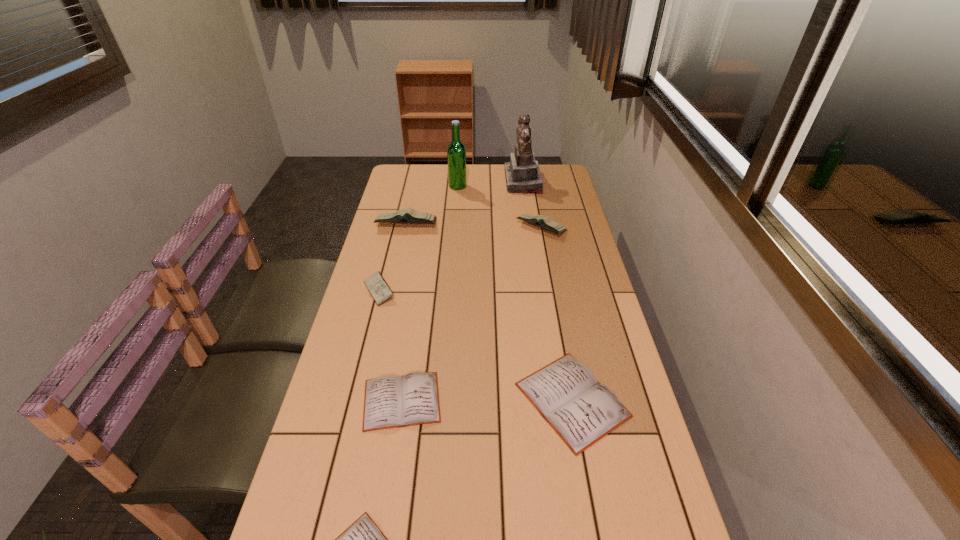
Find the location of `the seventh tallest object`. the seventh tallest object is located at coordinates (390, 401).

Find the location of a particular element. The height and width of the screenshot is (540, 960). the fifth tallest diary is located at coordinates (390, 401).

Where is `blank space located 0.390m on the front-facing side of the figurine`? This screenshot has height=540, width=960. blank space located 0.390m on the front-facing side of the figurine is located at coordinates (414, 182).

Where is `vacant region located on the front-facing side of the figurine`? This screenshot has height=540, width=960. vacant region located on the front-facing side of the figurine is located at coordinates (477, 182).

Find the location of a particular element. free region located on the front-facing side of the figurine is located at coordinates (427, 182).

You are a GUI agent. You are given a task and a screenshot of the screen. Output one action in this format:
    pyautogui.click(x=<x>, y=<y>)
    Task: Click on the free location located on the front of the green beer bottle
    
    Given the screenshot: What is the action you would take?
    [x=455, y=222]

Image resolution: width=960 pixels, height=540 pixels. I want to click on free space located on the right of the biggest pink diary, so click(476, 224).

Where is `vacant position located on the front of the fifth shortest diary`? vacant position located on the front of the fifth shortest diary is located at coordinates (551, 281).

At what (x,y) coordinates should I click in order to perform the action: click on vacant area situated 0.110m on the back of the fourth shortest object. Please return your answer as a coordinate pair (x, y). Image resolution: width=960 pixels, height=540 pixels. Looking at the image, I should click on (388, 255).

Locate an element on the screen. The width and height of the screenshot is (960, 540). free space located on the back of the third shortest object is located at coordinates (553, 295).